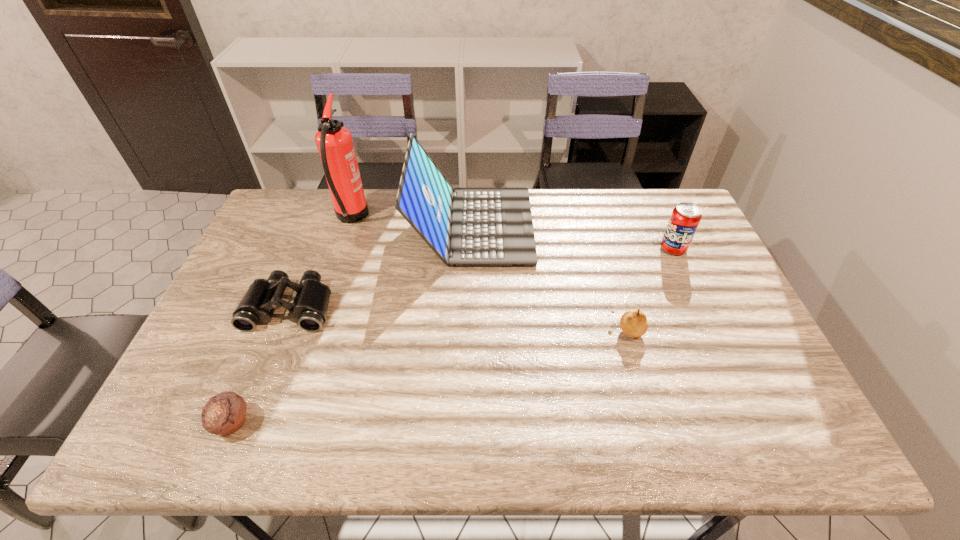
Image resolution: width=960 pixels, height=540 pixels. What are the coordinates of `vacant point that satisfies the following two spatial constraints: 1. at the nozzle of the tallest object; 2. on the front-facing side of the binoculars` in the screenshot? It's located at (323, 307).

At what (x,y) coordinates should I click in order to perform the action: click on free location that satisfies the following two spatial constraints: 1. on the front-facing side of the binoculars; 2. on the left side of the second object from right to left. Please return your answer as a coordinate pair (x, y). The image size is (960, 540). Looking at the image, I should click on (281, 330).

In order to click on free space that satisfies the following two spatial constraints: 1. at the nozzle of the tallest object; 2. on the front-facing side of the binoculars in this screenshot , I will do `click(323, 307)`.

Image resolution: width=960 pixels, height=540 pixels. I want to click on vacant space that satisfies the following two spatial constraints: 1. on the screen of the laptop computer; 2. on the right side of the fifth object from left to right, so click(x=469, y=330).

This screenshot has width=960, height=540. I want to click on free region that satisfies the following two spatial constraints: 1. at the nozzle of the tallest object; 2. on the back side of the fifth object from left to right, so click(315, 330).

At what (x,y) coordinates should I click in order to perform the action: click on free space in the image that satisfies the following two spatial constraints: 1. on the screen of the second tallest object; 2. on the right side of the fifth object from left to right. Please return your answer as a coordinate pair (x, y). The width and height of the screenshot is (960, 540). Looking at the image, I should click on (469, 330).

This screenshot has height=540, width=960. I want to click on vacant space that satisfies the following two spatial constraints: 1. at the nozzle of the fourth shortest object; 2. on the left side of the fire extinguisher, so pos(342,248).

Find the location of a particular element. free region that satisfies the following two spatial constraints: 1. at the nozzle of the second object from right to left; 2. on the left side of the tallest object is located at coordinates (315, 330).

Where is `free spot that satisfies the following two spatial constraints: 1. on the screen of the laptop computer; 2. on the right side of the second object from right to left`? The height and width of the screenshot is (540, 960). free spot that satisfies the following two spatial constraints: 1. on the screen of the laptop computer; 2. on the right side of the second object from right to left is located at coordinates (469, 330).

Identify the location of blank space that satisfies the following two spatial constraints: 1. on the screen of the fourth object from left to right; 2. on the right side of the pear. (469, 330).